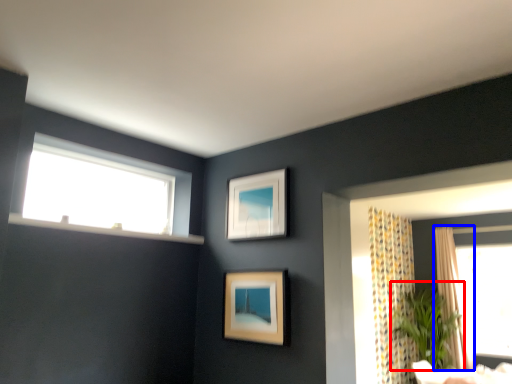
Question: Which point is closer to the camera, plant (highlighted by a red box) or curtain (highlighted by a blue box)?

Choices:
 (A) plant
 (B) curtain

Answer: (A)